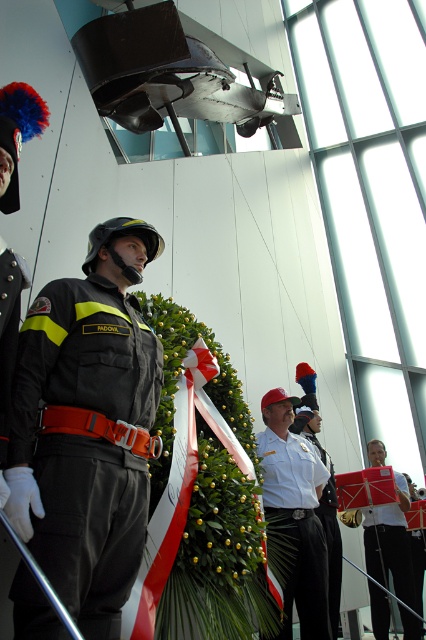
Can you confirm if dark gray matte uniform at left is positioned to the left of white cotton shirt at center?

Correct, you'll find dark gray matte uniform at left to the left of white cotton shirt at center.

Who is more forward, (29, 582) or (267, 497)?

Positioned in front is point (29, 582).

This screenshot has width=426, height=640. I want to click on dark gray matte uniform at left, so click(x=86, y=442).

Who is positioned more to the left, matte black uniform at lower right or white glossy uniform at center?

white glossy uniform at center

Where is `matte black uniform at lower right`? matte black uniform at lower right is located at coordinates (388, 548).

Locate an element on the screen. matte black uniform at lower right is located at coordinates (388, 548).

Is white cotton shirt at center above matte black uniform at lower right?

Correct, white cotton shirt at center is located above matte black uniform at lower right.

Which is more to the left, white cotton shirt at center or matte black uniform at lower right?

From the viewer's perspective, white cotton shirt at center appears more on the left side.

The width and height of the screenshot is (426, 640). I want to click on white cotton shirt at center, so click(298, 524).